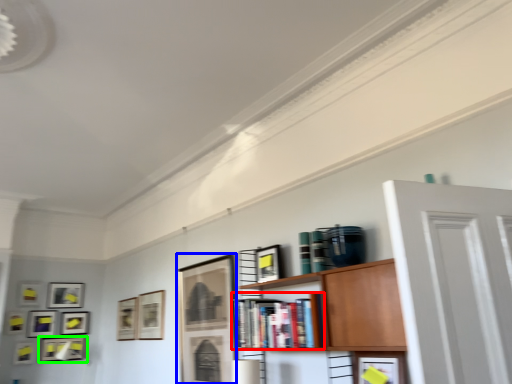
Question: Considering the real-world distances, which object is closest to book (highlighted by a red box)? picture frame (highlighted by a blue box) or picture frame (highlighted by a green box).

Choices:
 (A) picture frame
 (B) picture frame

Answer: (A)